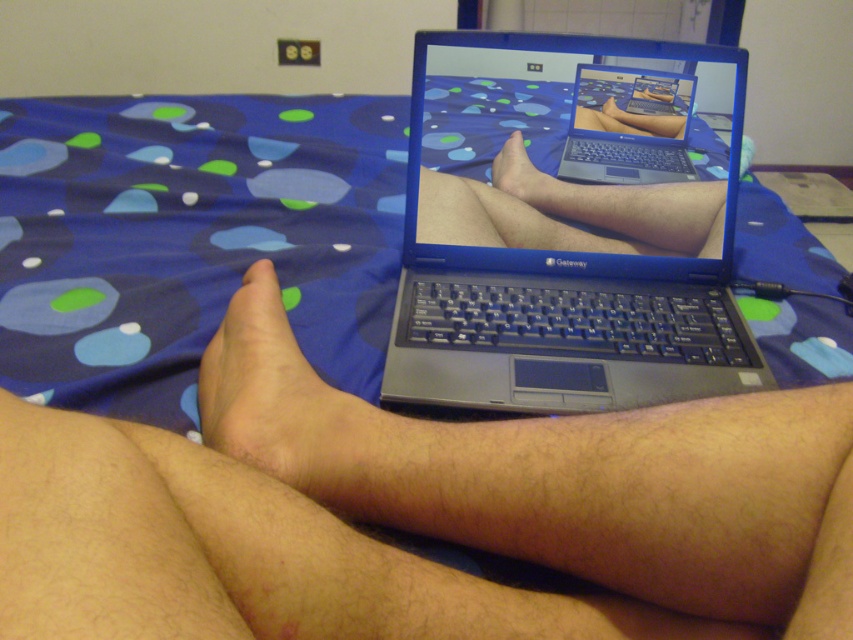
Question: Which point is farther to the camera?

Choices:
 (A) (666, 134)
 (B) (323, 385)
 (C) (538, 193)
 (D) (437, 225)

Answer: (A)

Question: Among these objects, which one is nearest to the camera?

Choices:
 (A) silver metallic laptop at center
 (B) skinny tan skin at center

Answer: (B)

Question: Is black plastic laptop at center smaller than silver metallic laptop at center?

Choices:
 (A) no
 (B) yes

Answer: (A)

Question: Observing the image, what is the correct spatial positioning of black plastic laptop at center in reference to skinny tan skin at center?

Choices:
 (A) left
 (B) right

Answer: (B)

Question: Can you confirm if black plastic laptop at center is smaller than silver metallic laptop at center?

Choices:
 (A) no
 (B) yes

Answer: (A)

Question: Among these points, which one is nearest to the camera?

Choices:
 (A) (532, 372)
 (B) (643, 92)
 (C) (517, 140)

Answer: (A)